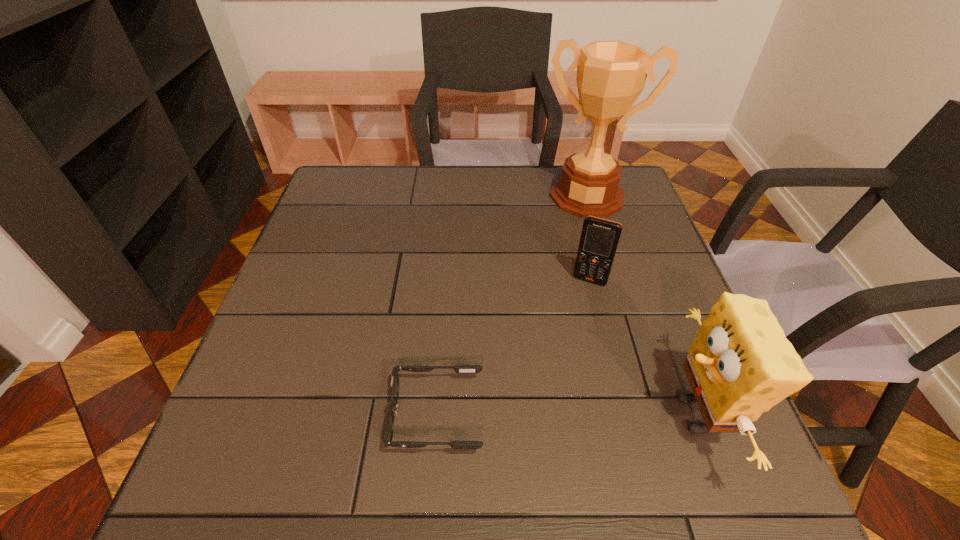
The height and width of the screenshot is (540, 960). Identify the location of free point between the leftmost object and the second farthest object. (513, 348).

Identify the location of vacant area that lies between the shortest object and the cellular telephone. The image size is (960, 540). (513, 348).

Identify the location of free space between the sponge and the sunglasses. Image resolution: width=960 pixels, height=540 pixels. (566, 415).

Image resolution: width=960 pixels, height=540 pixels. I want to click on the second closest object relative to the award, so click(x=740, y=364).

The image size is (960, 540). I want to click on object that stands as the second closest to the cellular telephone, so click(x=611, y=75).

Find the location of `free point that satisfies the following two spatial constraints: 1. on the front side of the farthest object; 2. on the face of the sponge`. free point that satisfies the following two spatial constraints: 1. on the front side of the farthest object; 2. on the face of the sponge is located at coordinates (651, 415).